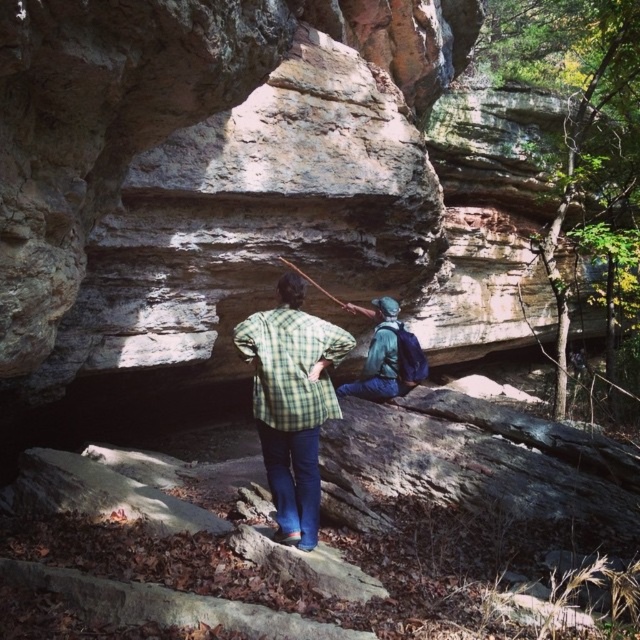
Question: Among these objects, which one is nearest to the camera?

Choices:
 (A) green plaid shirt at center
 (B) blue-green fabric backpack at center

Answer: (A)

Question: Is green plaid shirt at center positioned at the back of blue-green fabric backpack at center?

Choices:
 (A) no
 (B) yes

Answer: (A)

Question: Where is green plaid shirt at center located in relation to blue-green fabric backpack at center in the image?

Choices:
 (A) below
 (B) above

Answer: (A)

Question: Can you confirm if green plaid shirt at center is thinner than blue-green fabric backpack at center?

Choices:
 (A) yes
 (B) no

Answer: (A)

Question: Which object is closer to the camera taking this photo?

Choices:
 (A) green plaid shirt at center
 (B) blue-green fabric backpack at center

Answer: (A)